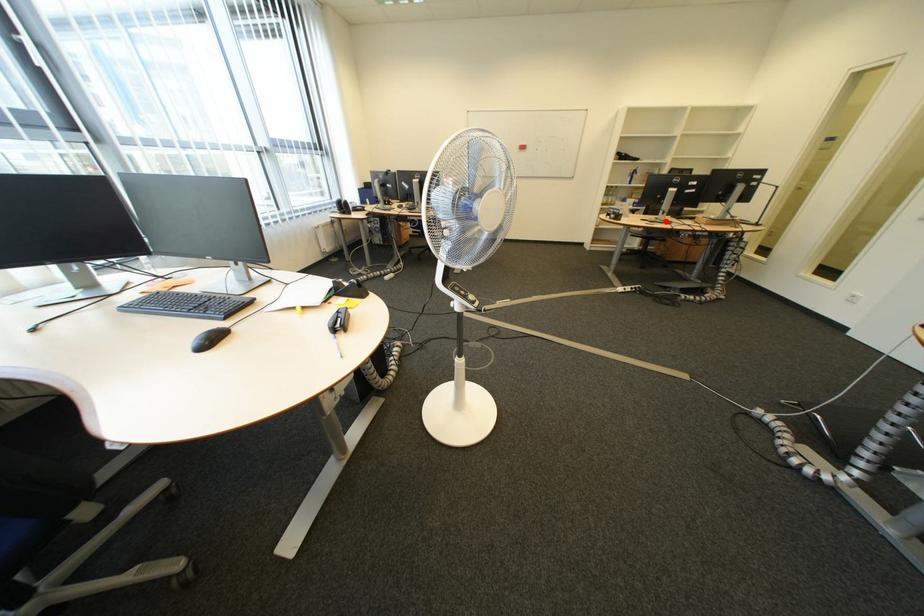
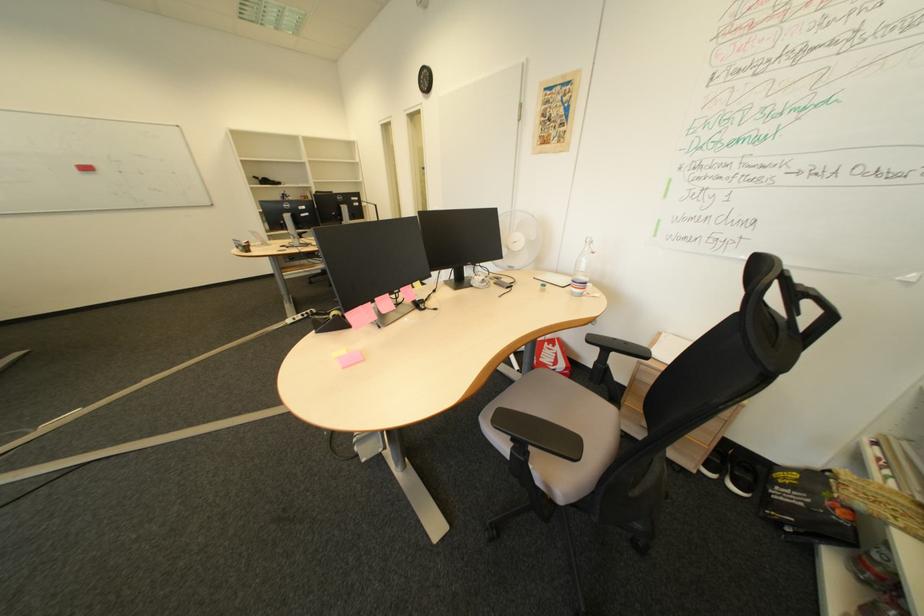
Where in the second image is the point corresponding to the highlighted location from the first image?

(301, 246)